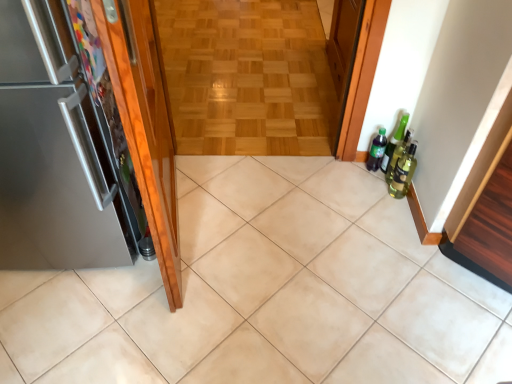
This screenshot has height=384, width=512. I want to click on free area in between satin metallic refrigerator at left, the 1th door in the left-to-right sequence, and green matte bottle at right, so pyautogui.click(x=260, y=195).